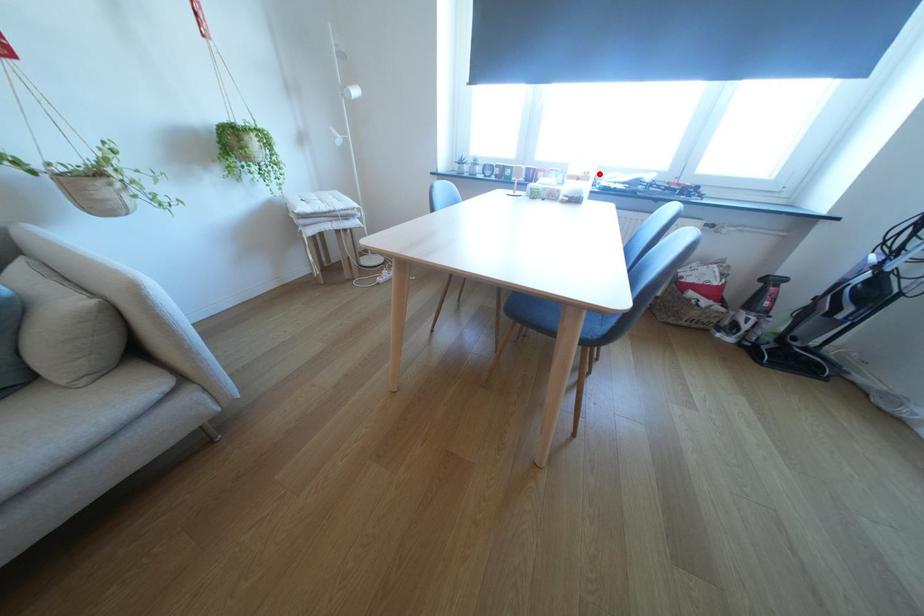
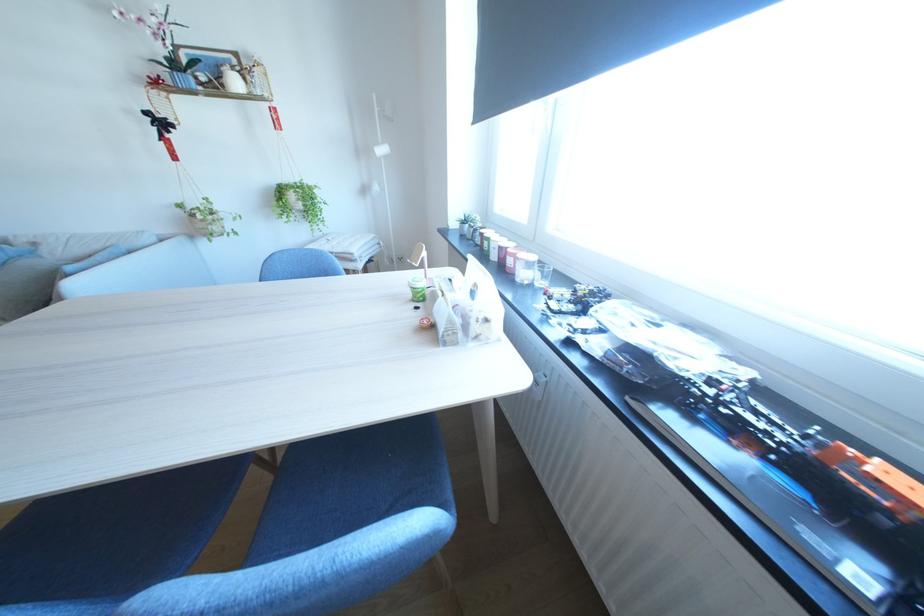
Question: A red point is marked in image1. In image2, is the corresponding 3D point closer to the camera or farther? Reply with the corresponding letter.

Choices:
 (A) The corresponding 3D point is closer.
 (B) The corresponding 3D point is farther.

Answer: (B)